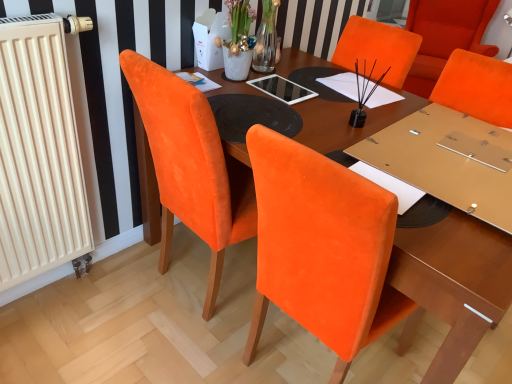
Question: Does point (457, 296) appear closer or farther from the camera than point (489, 14)?

Choices:
 (A) closer
 (B) farther

Answer: (A)

Question: From a real-world perspective, is wooden table at center above or below velvet orange chair at upper right?

Choices:
 (A) above
 (B) below

Answer: (B)

Question: Considering the real-world distances, which object is farthest from the wooden table at center?

Choices:
 (A) beige radiator at left
 (B) velvet orange chair at upper right

Answer: (B)

Question: Which object is positioned closest to the velvet orange chair at upper right?

Choices:
 (A) beige radiator at left
 (B) wooden table at center

Answer: (B)